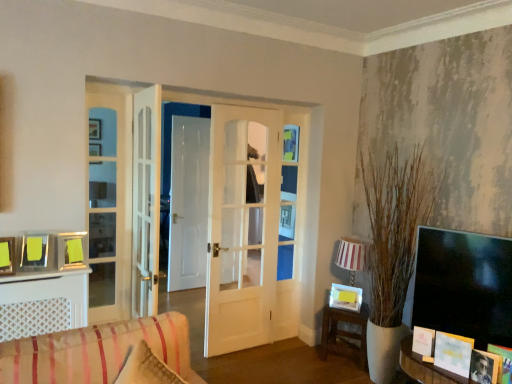
At what (x,y) coordinates should I click in order to perform the action: click on free spot in front of wooden table at lower right. Please return your answer as a coordinate pair (x, y). This screenshot has height=384, width=512. Looking at the image, I should click on (341, 376).